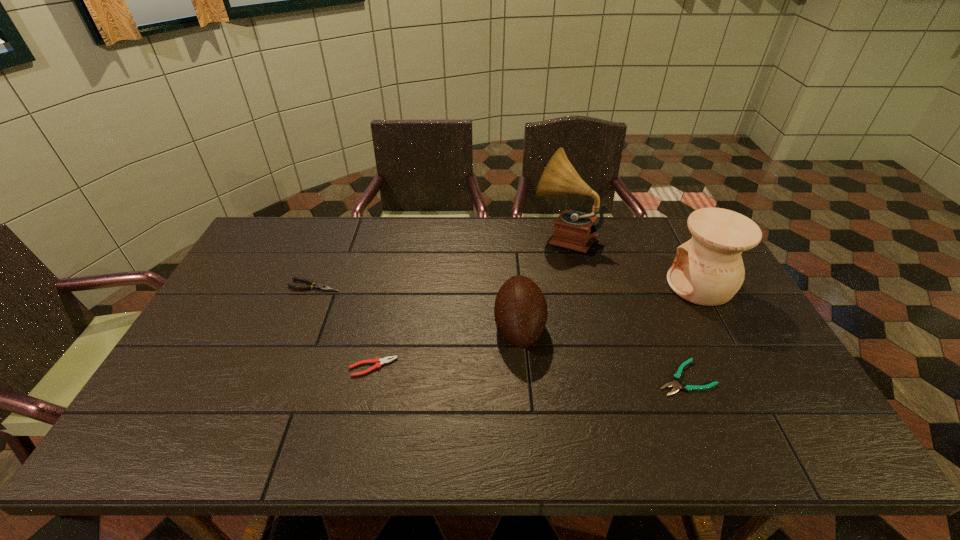
Where is `free space located 0.060m on the back of the second pliers from right to left`? free space located 0.060m on the back of the second pliers from right to left is located at coordinates click(379, 340).

Locate an element on the screen. free location located 0.320m on the back of the rightmost pliers is located at coordinates (644, 279).

Where is `object at the far edge`? This screenshot has width=960, height=540. object at the far edge is located at coordinates (574, 230).

Where is `object located at the right edge`? The width and height of the screenshot is (960, 540). object located at the right edge is located at coordinates (708, 270).

Image resolution: width=960 pixels, height=540 pixels. Identify the location of vacant space at the far edge of the desktop. (453, 218).

I want to click on free space at the near edge of the desktop, so click(603, 441).

The height and width of the screenshot is (540, 960). Find the location of `vacant region at the left edge of the desktop`. vacant region at the left edge of the desktop is located at coordinates (229, 294).

Locate an element on the screen. Image resolution: width=960 pixels, height=540 pixels. free point at the right edge is located at coordinates (727, 321).

Locate an element on the screen. This screenshot has height=540, width=960. free space at the far left corner of the desktop is located at coordinates (301, 221).

In order to click on vacant space at the near right corner of the desktop in this screenshot , I will do `click(806, 423)`.